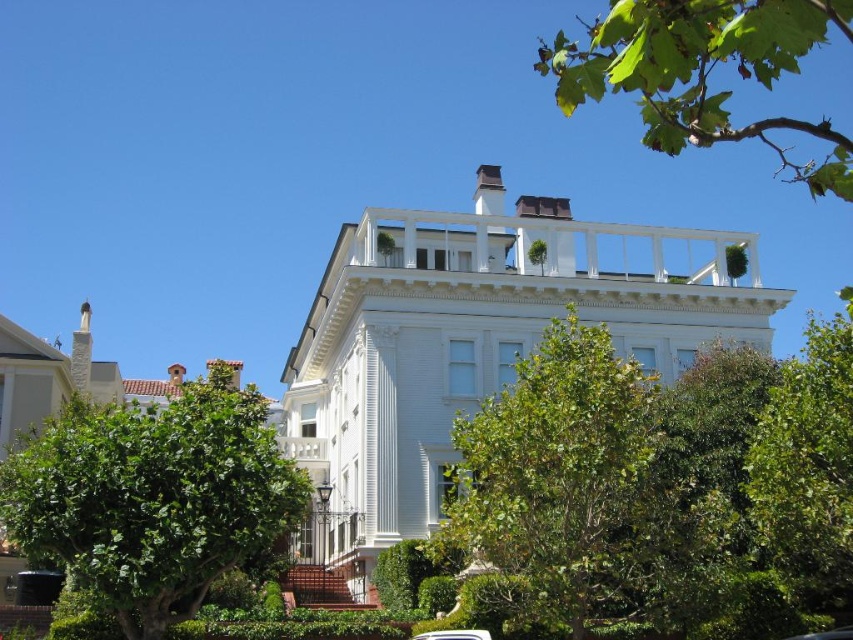
Does green leafy tree at center appear on the left side of green leafy branch at upper right?

Indeed, green leafy tree at center is positioned on the left side of green leafy branch at upper right.

The image size is (853, 640). Describe the element at coordinates (567, 483) in the screenshot. I see `green leafy tree at center` at that location.

Locate an element on the screen. The image size is (853, 640). green leafy tree at center is located at coordinates (567, 483).

Is the position of green leafy tree at lower left less distant than that of white glossy car at center?

Yes.

Is point (62, 499) farther from viewer compared to point (462, 630)?

That is False.

Between point (199, 486) and point (433, 634), which one is positioned behind?

Positioned behind is point (433, 634).

Locate an element on the screen. The height and width of the screenshot is (640, 853). green leafy tree at lower left is located at coordinates (154, 497).

From the picture: Can you confirm if white wood mansion at center is positioned below green leafy tree at lower left?

No, white wood mansion at center is not below green leafy tree at lower left.

Who is positioned more to the right, white wood mansion at center or green leafy tree at lower left?

From the viewer's perspective, white wood mansion at center appears more on the right side.

I want to click on white wood mansion at center, so click(474, 344).